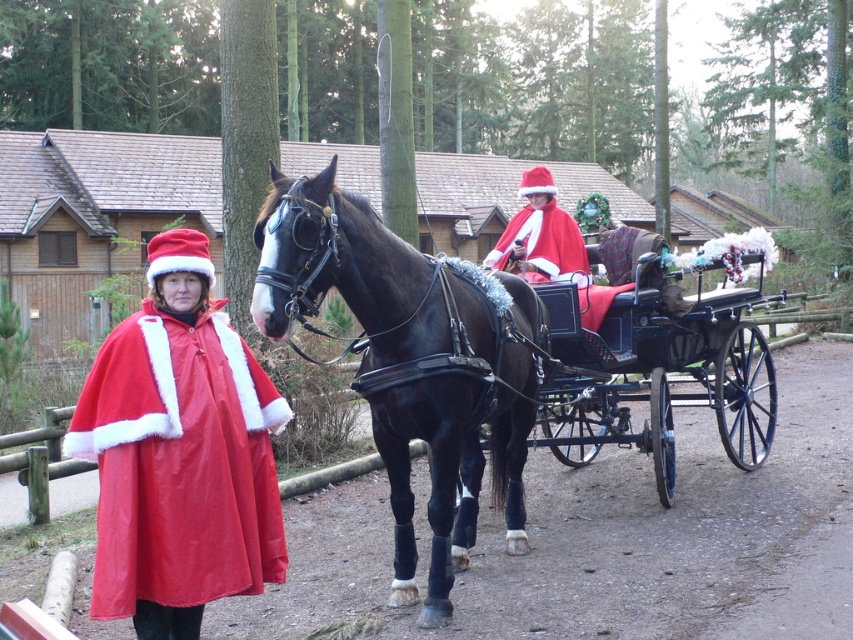
Question: Which point is closer to the camera?

Choices:
 (A) (664, 397)
 (B) (486, 262)

Answer: (B)

Question: Does black polished wood cart at center appear under velvet red cape at center?

Choices:
 (A) yes
 (B) no

Answer: (A)

Question: Which point is closer to the camera?

Choices:
 (A) velvet red cape at center
 (B) black polished wood cart at center
 (C) shiny red cape at left

Answer: (C)

Question: Which object is closer to the camera taking this photo?

Choices:
 (A) velvet red cape at center
 (B) black polished wood cart at center
 (C) shiny red cape at left
 (D) shiny black horse at center

Answer: (C)

Question: Is black polished wood cart at center to the left of velvet red cape at center from the viewer's perspective?

Choices:
 (A) no
 (B) yes

Answer: (A)

Question: Can you confirm if shiny black horse at center is wider than velvet red cape at center?

Choices:
 (A) no
 (B) yes

Answer: (B)